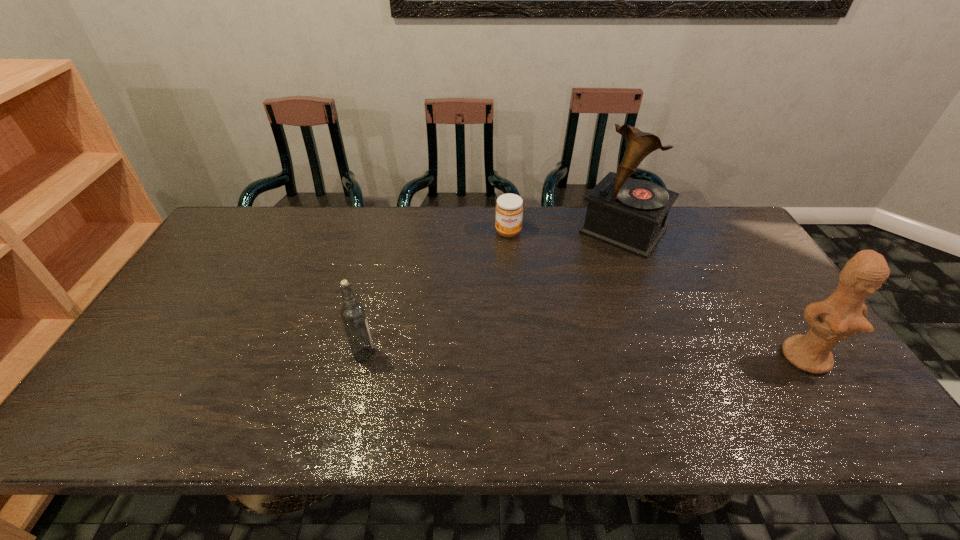
Find the location of a particular element. The width and height of the screenshot is (960, 540). vacant region at the far edge of the desktop is located at coordinates (286, 246).

Image resolution: width=960 pixels, height=540 pixels. Identify the location of free space at the near edge. (403, 380).

You are a GUI agent. You are given a task and a screenshot of the screen. Output one action in this format:
    pyautogui.click(x=<x>, y=<y>)
    Task: Click on the vacant position at the left edge of the desktop
    The height and width of the screenshot is (540, 960).
    Given the screenshot: What is the action you would take?
    pyautogui.click(x=244, y=258)

Locate an element on the screen. free spot at the right edge of the desktop is located at coordinates (763, 307).

Locate an element on the screen. vacant area that lies between the phonograph_record and the rightmost object is located at coordinates (714, 294).

You are a GUI agent. You are given a task and a screenshot of the screen. Output one action in this format:
    pyautogui.click(x=<x>, y=<y>)
    Task: Click on the free spot between the shortest object and the rightmost object
    
    Given the screenshot: What is the action you would take?
    pyautogui.click(x=658, y=295)

Image resolution: width=960 pixels, height=540 pixels. I want to click on empty space between the third shortest object and the shortest object, so click(658, 295).

This screenshot has width=960, height=540. I want to click on vacant point located between the phonograph_record and the second tallest object, so click(x=714, y=294).

Locate an element on the screen. The width and height of the screenshot is (960, 540). free space between the shortest object and the phonograph_record is located at coordinates (565, 232).

The width and height of the screenshot is (960, 540). I want to click on free spot between the tallest object and the figurine, so click(714, 294).